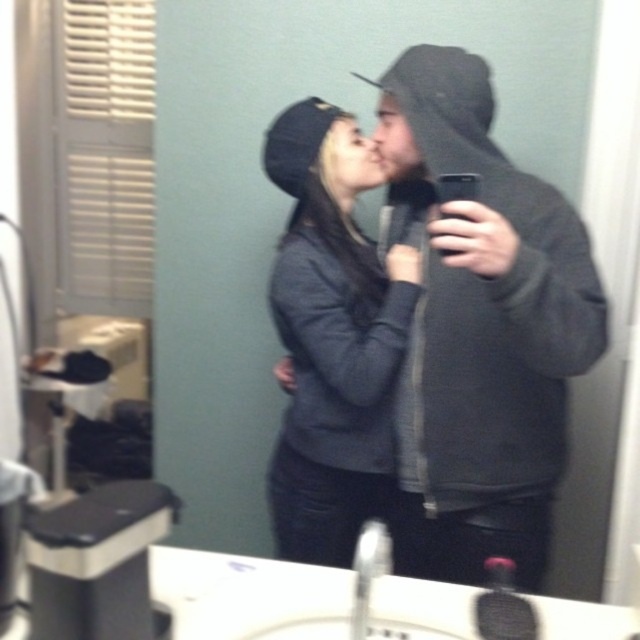
Question: Among these objects, which one is farthest from the camera?

Choices:
 (A) dark gray sweater at center
 (B) dark gray hoodie at center

Answer: (A)

Question: In this image, where is dark gray hoodie at center located relative to dark gray sweater at center?

Choices:
 (A) right
 (B) left

Answer: (A)

Question: Which object appears farthest from the camera in this image?

Choices:
 (A) dark gray sweater at center
 (B) dark gray hoodie at center

Answer: (A)

Question: Can you confirm if dark gray hoodie at center is positioned to the left of dark gray sweater at center?

Choices:
 (A) yes
 (B) no

Answer: (B)

Question: In this image, where is dark gray hoodie at center located relative to dark gray sweater at center?

Choices:
 (A) above
 (B) below

Answer: (A)